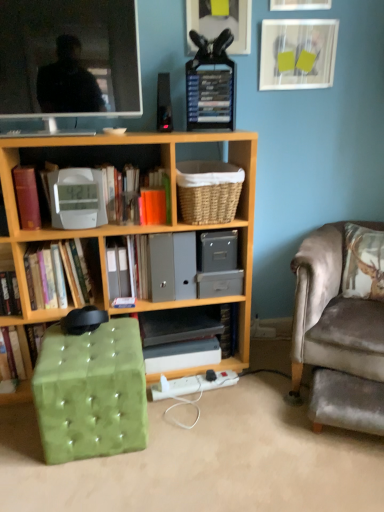
Identify the location of vacant space that is in between green tufted ottoman at lower left and white plastic charger at lower center. The width and height of the screenshot is (384, 512). (189, 410).